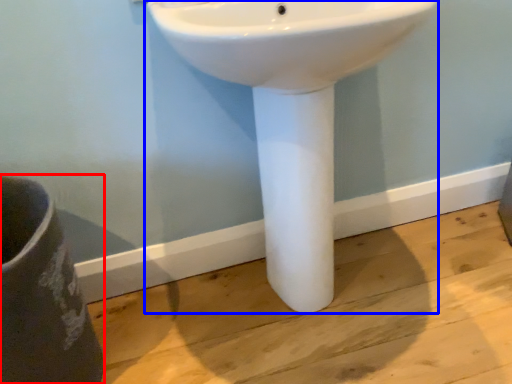
Question: Which of the following is the closest to the observer, porcelain (highlighted by a red box) or sink (highlighted by a blue box)?

Choices:
 (A) porcelain
 (B) sink

Answer: (B)